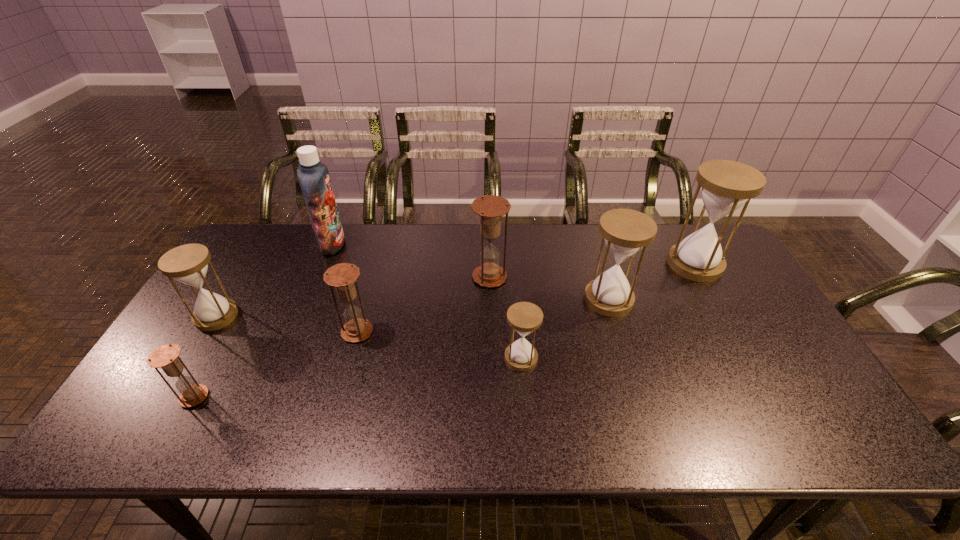
The image size is (960, 540). In order to click on the second smallest white hourglass in this screenshot , I will do `click(188, 263)`.

Locate an element on the screen. The image size is (960, 540). the nearest white hourglass is located at coordinates (524, 317).

This screenshot has height=540, width=960. I want to click on the second nearest object, so click(524, 317).

Locate an element on the screen. the smallest brown hourglass is located at coordinates (166, 357).

The height and width of the screenshot is (540, 960). Identify the location of the nearest object. point(166,357).

Where is `free point located on the front label of the blue shampoo`? The image size is (960, 540). free point located on the front label of the blue shampoo is located at coordinates (457, 244).

Find the location of `vacant space located 0.350m on the left of the biggest white hourglass`. vacant space located 0.350m on the left of the biggest white hourglass is located at coordinates (560, 264).

Identify the location of blank space located 0.170m on the back of the biggest brown hourglass. This screenshot has width=960, height=540. (489, 234).

The height and width of the screenshot is (540, 960). I want to click on free space located 0.120m on the right of the second object from right to left, so click(x=673, y=299).

Locate an element on the screen. The width and height of the screenshot is (960, 540). free space located 0.330m on the back of the second nearest brown hourglass is located at coordinates (380, 247).